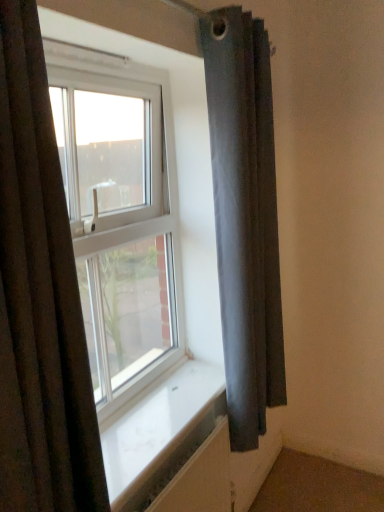
Question: From a real-world perspective, is white smooth window sill at center positioned above or below transparent glass window at center?

Choices:
 (A) above
 (B) below

Answer: (B)

Question: Considering the positions of white smooth window sill at center and transparent glass window at center in the image, is white smooth window sill at center taller or shorter than transparent glass window at center?

Choices:
 (A) tall
 (B) short

Answer: (B)

Question: Which object is the farthest from the white smooth window sill at center?

Choices:
 (A) dark fabric curtain at left, which is the 2th curtain from right to left
 (B) transparent glass window at center
 (C) dark gray fabric curtain at right, placed as the first curtain when sorted from back to front

Answer: (A)

Question: Which object is positioned farthest from the dark fabric curtain at left, which is the 2th curtain from right to left?

Choices:
 (A) white smooth window sill at center
 (B) dark gray fabric curtain at right, the 1th curtain in the right-to-left sequence
 (C) transparent glass window at center

Answer: (B)